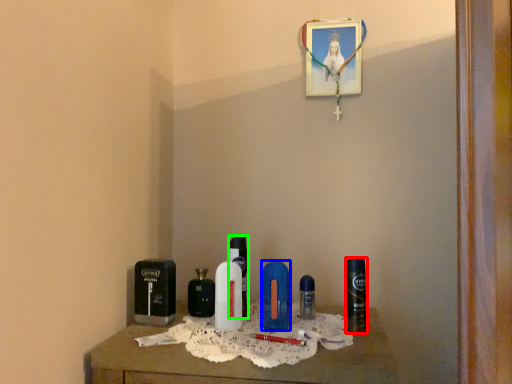
Question: Which object is the farthest from personal care (highlighted by a red box)? Choose among these: personal care (highlighted by a blue box) or perfume (highlighted by a green box).

Choices:
 (A) personal care
 (B) perfume

Answer: (B)